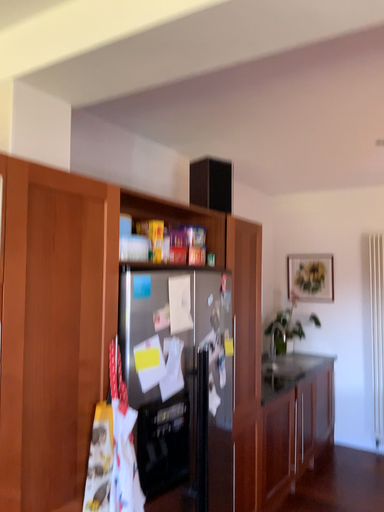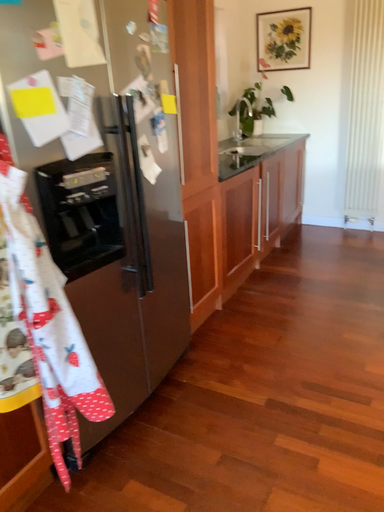
Question: Which way did the camera rotate in the video?

Choices:
 (A) rotated upward
 (B) rotated downward

Answer: (B)